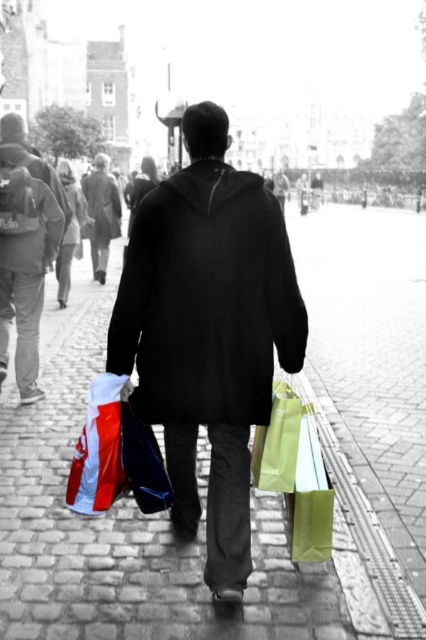
You are a delivery person who needs to deliver a package to the person carrying the white glossy shopping bag at lower left and the matte green paper bag at lower right. However, you can only reach one of them. Based on their positions, which bag is closer to you and thus easier to hand the package to?

The white glossy shopping bag at lower left is in front of the matte green paper bag at lower right, so it is closer to you and easier to hand the package to.

You are a delivery drone flying above the cobblestone street. You need to land on the cobblestone pavement at center to deliver a package. However, there is a matte green plastic bag at lower right nearby. Which surface should you choose for a safe landing and why?

The cobblestone pavement at center is the safer landing surface because it has a greater height compared to the matte green plastic bag at lower right, making it more stable and suitable for landing.

You are a delivery person who needs to place a heavy box on the ground. The cobblestone pavement at center and the matte green plastic bag at lower right are both visible. Which surface is more suitable for placing the box to avoid damaging it?

The cobblestone pavement at center is more suitable because it is a solid surface located above the matte green plastic bag at lower right, which is likely not a stable surface for placing heavy items.